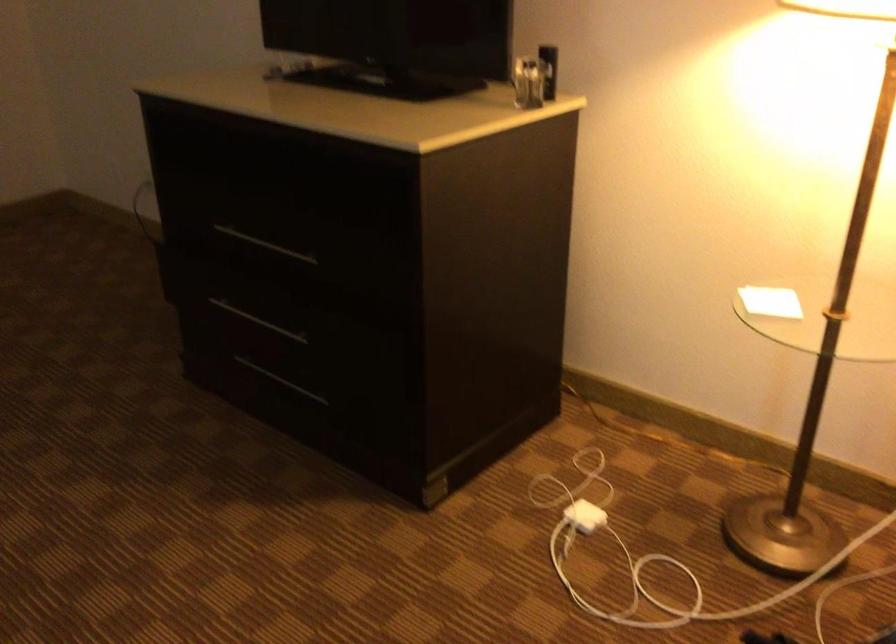
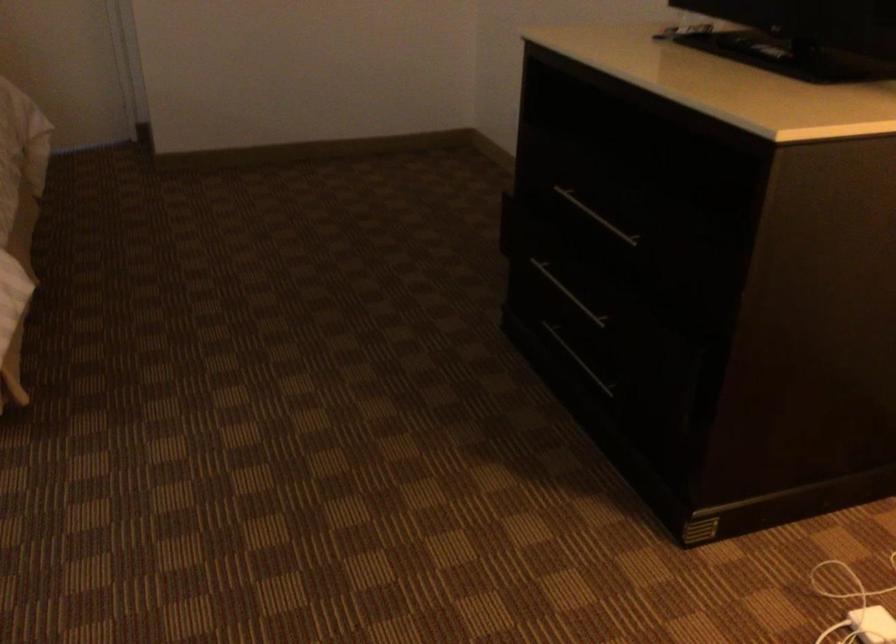
Where in the second image is the point corresponding to pixel 576 518 from the first image?

(872, 625)